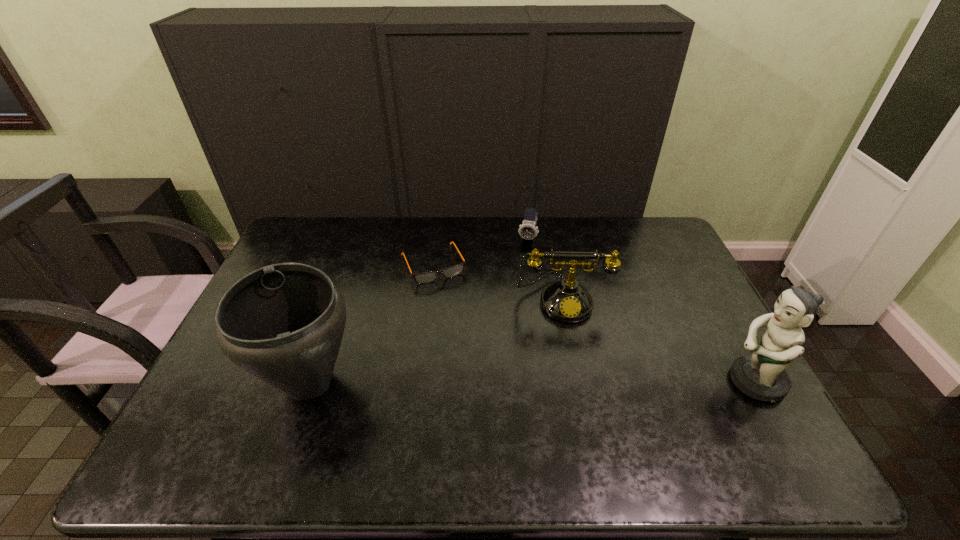
The image size is (960, 540). What are the coordinates of `vacant area situated 0.400m on the front-facing side of the shortest object` in the screenshot? It's located at (489, 383).

Find the location of a particular element. The width and height of the screenshot is (960, 540). vacant region located 0.300m on the front-facing side of the shortest object is located at coordinates (475, 354).

In order to click on vacant space situated on the front-facing side of the shortest object in this screenshot , I will do `click(470, 343)`.

The width and height of the screenshot is (960, 540). I want to click on vacant point located on the face of the fourth tallest object, so click(508, 322).

At what (x,y) coordinates should I click in order to perform the action: click on free space located on the face of the fourth tallest object. Please return your answer as a coordinate pair (x, y). Image resolution: width=960 pixels, height=540 pixels. Looking at the image, I should click on (518, 278).

I want to click on vacant space located 0.180m on the face of the fourth tallest object, so click(x=518, y=280).

At what (x,y) coordinates should I click in order to perform the action: click on vacant space located on the dial of the telephone. Please return your answer as a coordinate pair (x, y). Looking at the image, I should click on (579, 412).

At what (x,y) coordinates should I click in order to perform the action: click on free space located on the dial of the telephone. Please return your answer as a coordinate pair (x, y). The image size is (960, 540). Looking at the image, I should click on (577, 398).

The height and width of the screenshot is (540, 960). Find the location of `vacant space located on the dial of the telephone`. vacant space located on the dial of the telephone is located at coordinates (570, 359).

Find the location of a particular element. This screenshot has width=960, height=540. spectacles that is at the far edge is located at coordinates (426, 277).